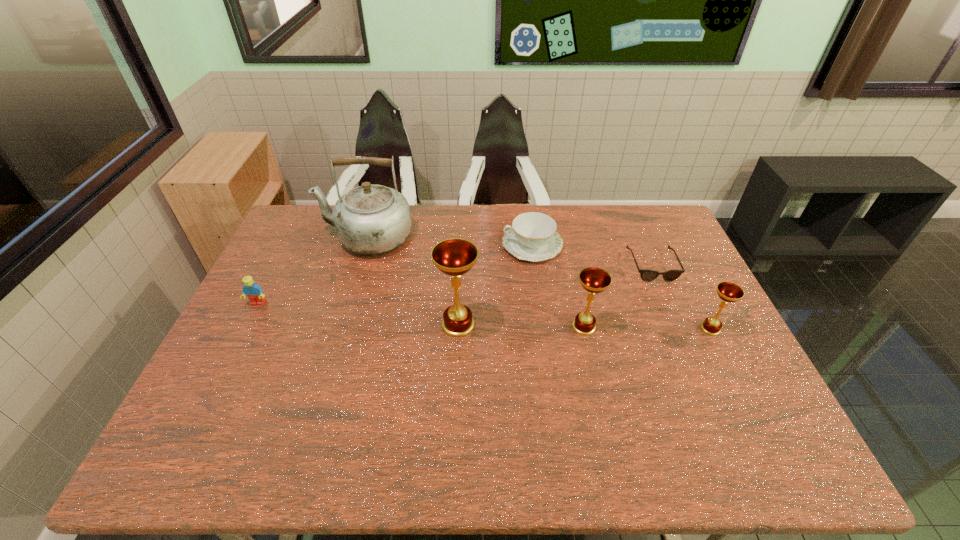
Where is `the second tallest object`? The width and height of the screenshot is (960, 540). the second tallest object is located at coordinates (454, 257).

This screenshot has width=960, height=540. In order to click on the fifth object from right to left in this screenshot , I will do (x=454, y=257).

This screenshot has width=960, height=540. I want to click on the second shortest chalice, so click(x=594, y=280).

Where is `the fifth shortest object`? This screenshot has width=960, height=540. the fifth shortest object is located at coordinates (594, 280).

What are the coordinates of `the fourth tallest object` in the screenshot? It's located at (729, 292).

The image size is (960, 540). In order to click on the rightmost chalice in this screenshot , I will do `click(729, 292)`.

This screenshot has width=960, height=540. In order to click on chinaware in this screenshot , I will do `click(533, 236)`.

You are a GUI agent. You are given a task and a screenshot of the screen. Output one action in this format:
    pyautogui.click(x=<x>, y=<y>)
    Task: Click on the kettle
    
    Given the screenshot: What is the action you would take?
    pyautogui.click(x=371, y=219)

Identify the location of the shortest object. (646, 275).

The height and width of the screenshot is (540, 960). Identify the location of the fourth farthest object. (251, 290).